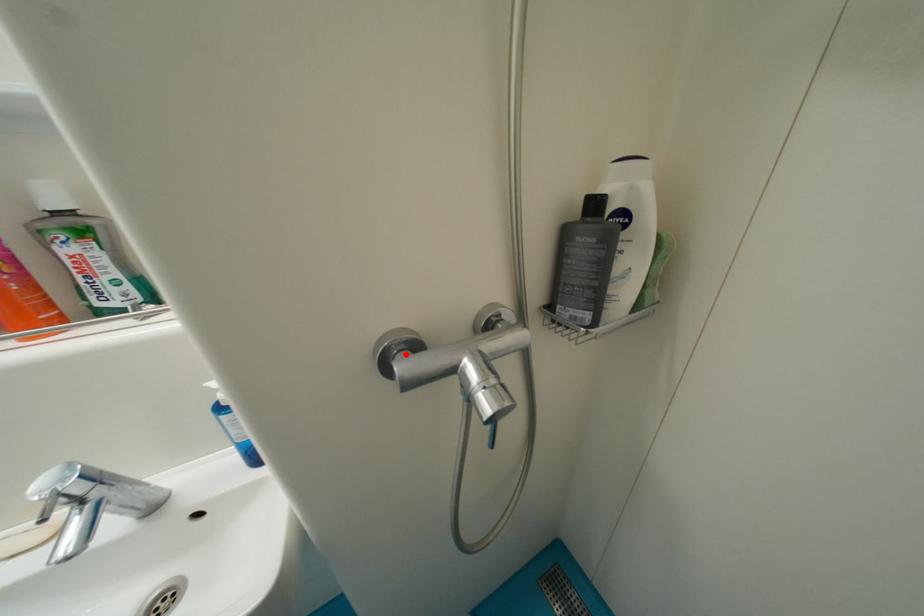
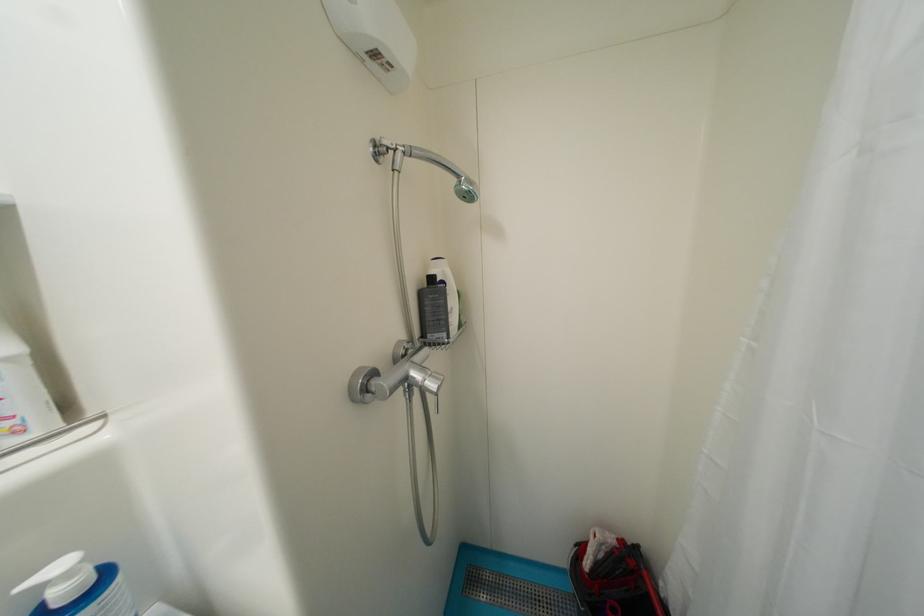
Where in the second image is the point corresponding to the highlighted location from the first image?

(374, 383)